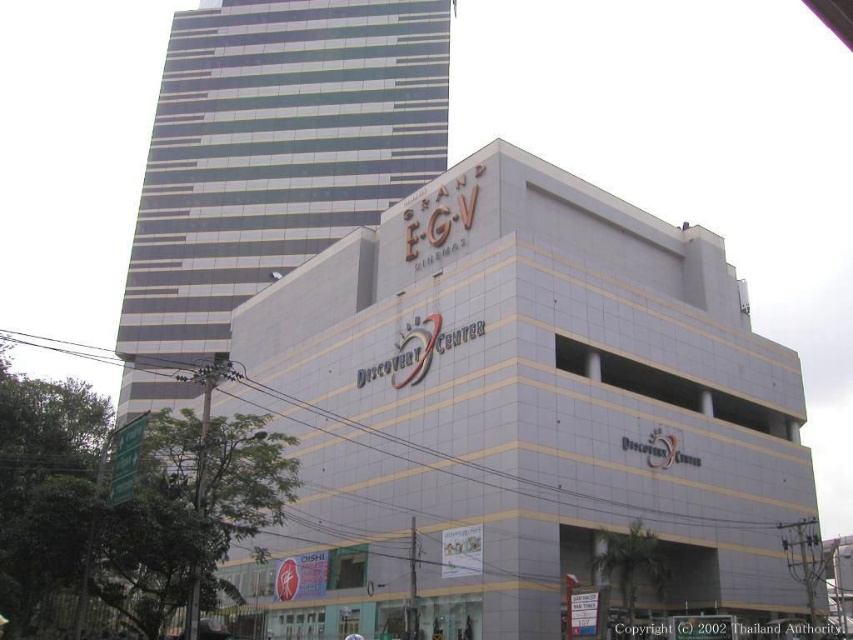
You are a drone operator who needs to fly a drone between the white smooth building at center and the metallic glass building at upper left. The drone has a maximum flight distance of 50 meters. Can the drone safely complete this flight without exceeding its range?

The white smooth building at center and metallic glass building at upper left are 56.62 meters apart, which exceeds the drone maximum flight distance of 50 meters. The drone cannot safely complete this flight without exceeding its range.

What does the point at coordinates (517, 416) represent in the image?

The point at coordinates (517, 416) indicates the location of the white smooth building at center.

You are standing at the point with coordinates point (x=281, y=125) and want to walk to the point with coordinates point (x=802, y=605). Which direction should you move to get closer to your destination?

You should move forward because point (x=802, y=605) is in front of point (x=281, y=125).